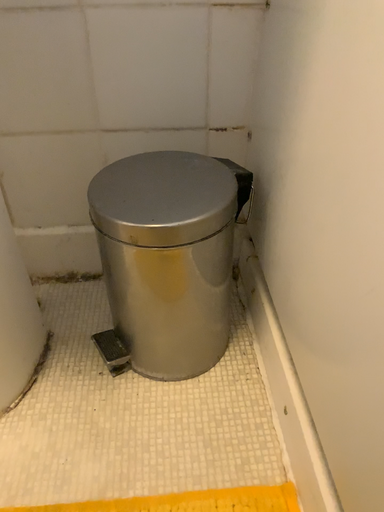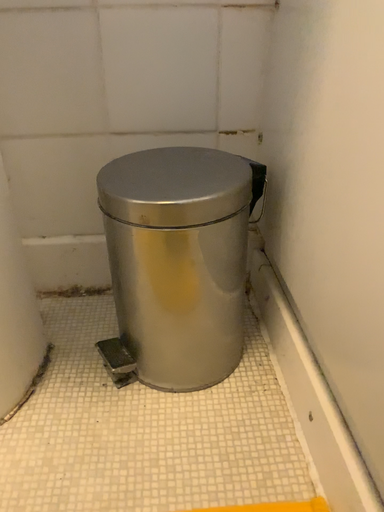
Question: Which way did the camera rotate in the video?

Choices:
 (A) rotated downward
 (B) rotated upward

Answer: (B)